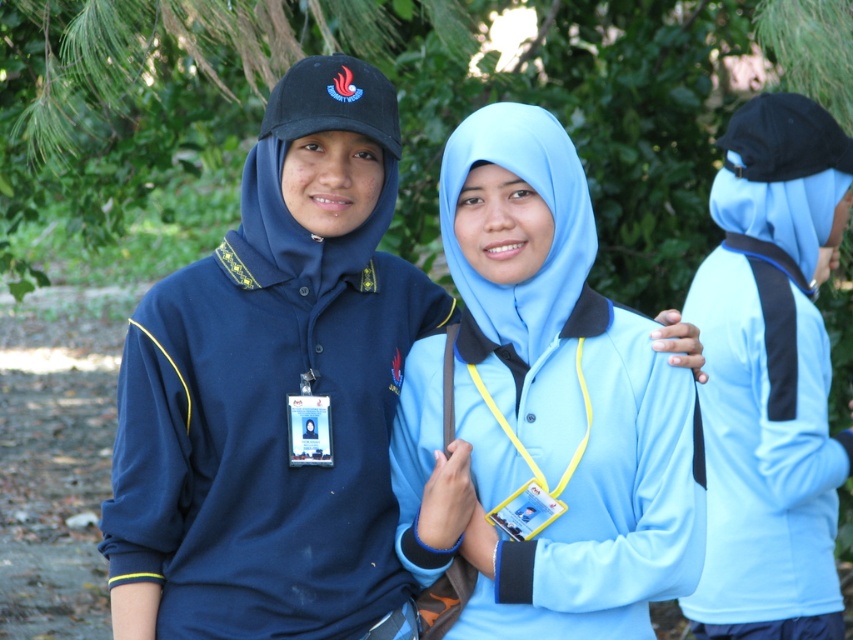
Which is below, light blue fabric hijab at center or light blue fabric at right?

Positioned lower is light blue fabric hijab at center.

Is point (477, 602) closer to viewer compared to point (753, 109)?

Yes, it is.

Where is `light blue fabric hijab at center`? The image size is (853, 640). light blue fabric hijab at center is located at coordinates (544, 406).

Does matte blue hoodie at center appear on the left side of light blue fabric at right?

Correct, you'll find matte blue hoodie at center to the left of light blue fabric at right.

Does point (368, 209) come in front of point (718, 632)?

That is True.

This screenshot has height=640, width=853. I want to click on matte blue hoodie at center, so click(x=276, y=392).

The width and height of the screenshot is (853, 640). What are the coordinates of `matte blue hoodie at center` in the screenshot? It's located at (276, 392).

Is matte blue hoodie at center shorter than light blue fabric hijab at center?

Incorrect, matte blue hoodie at center's height does not fall short of light blue fabric hijab at center's.

Based on the photo, which is below, matte blue hoodie at center or light blue fabric hijab at center?

light blue fabric hijab at center is below.

Who is more forward, (289, 520) or (421, 522)?

Point (289, 520) is more forward.

At what (x,y) coordinates should I click in order to perform the action: click on matte blue hoodie at center. Please return your answer as a coordinate pair (x, y). This screenshot has width=853, height=640. Looking at the image, I should click on (276, 392).